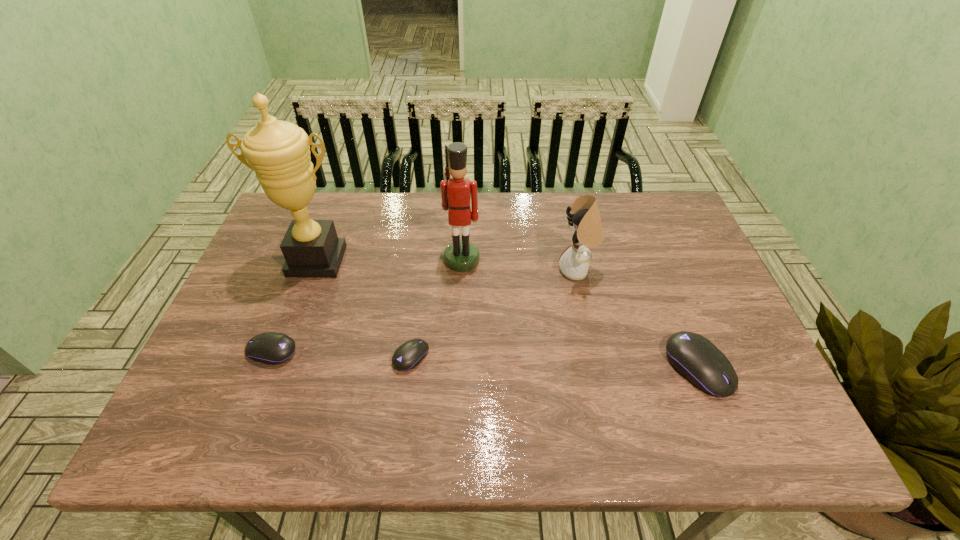
Identify the location of object that is the third closest to the fourth tallest object. The width and height of the screenshot is (960, 540). (407, 356).

Where is `object that stands as the closest to the fifth shortest object`? This screenshot has height=540, width=960. object that stands as the closest to the fifth shortest object is located at coordinates (585, 221).

Identify which computer mouse is the second closest to the third tallest object. Please provide its 2D coordinates. Your answer should be formatted as a tuple, i.e. [(x, y)], where the tuple contains the x and y coordinates of a point satisfying the conditions above.

[(407, 356)]

Identify which computer mouse is the second closest to the fifth tallest object. Please provide its 2D coordinates. Your answer should be formatted as a tuple, i.e. [(x, y)], where the tuple contains the x and y coordinates of a point satisfying the conditions above.

[(697, 359)]

You are a GUI agent. You are given a task and a screenshot of the screen. Output one action in this format:
    pyautogui.click(x=<x>, y=<y>)
    Task: Click on the free space that satisfies the following two spatial constraints: 1. at the front of the fourth tallest object with handles; 2. on the left side of the tallest object
    The width and height of the screenshot is (960, 540).
    Given the screenshot: What is the action you would take?
    pyautogui.click(x=277, y=368)

I want to click on blank area in the image that satisfies the following two spatial constraints: 1. on the front side of the second computer mouse from right to left; 2. on the left side of the second tallest computer mouse, so click(270, 356).

I want to click on vacant region that satisfies the following two spatial constraints: 1. on the front side of the second tallest computer mouse; 2. on the left side of the rightmost computer mouse, so click(x=265, y=368).